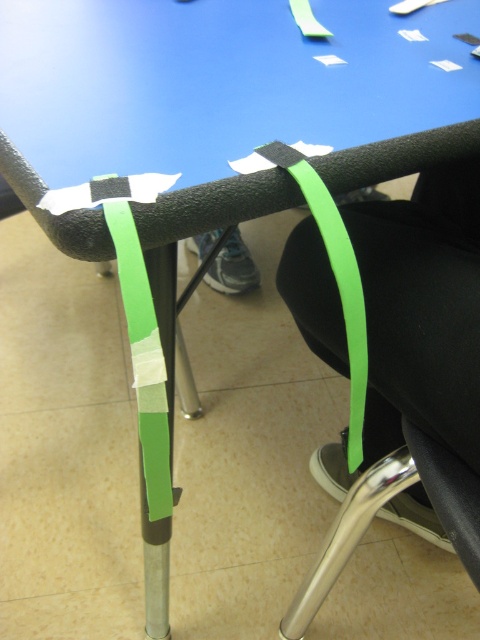
Question: Which object is closer to the camera taking this photo?

Choices:
 (A) green matte strip at center
 (B) green matte tape at center
 (C) green matte ribbon at center

Answer: (B)

Question: Does green matte tape at center have a greater width compared to green matte ribbon at center?

Choices:
 (A) yes
 (B) no

Answer: (B)

Question: Which object is closer to the camera taking this photo?

Choices:
 (A) green matte ribbon at center
 (B) green matte tape at center

Answer: (B)

Question: Can you confirm if green matte strip at center is wider than green matte ribbon at center?

Choices:
 (A) yes
 (B) no

Answer: (A)

Question: Is green matte strip at center thinner than green matte ribbon at center?

Choices:
 (A) no
 (B) yes

Answer: (A)

Question: Among these points, which one is nearest to the camera?

Choices:
 (A) (x=349, y=460)
 (B) (x=476, y=451)
 (C) (x=135, y=376)

Answer: (C)